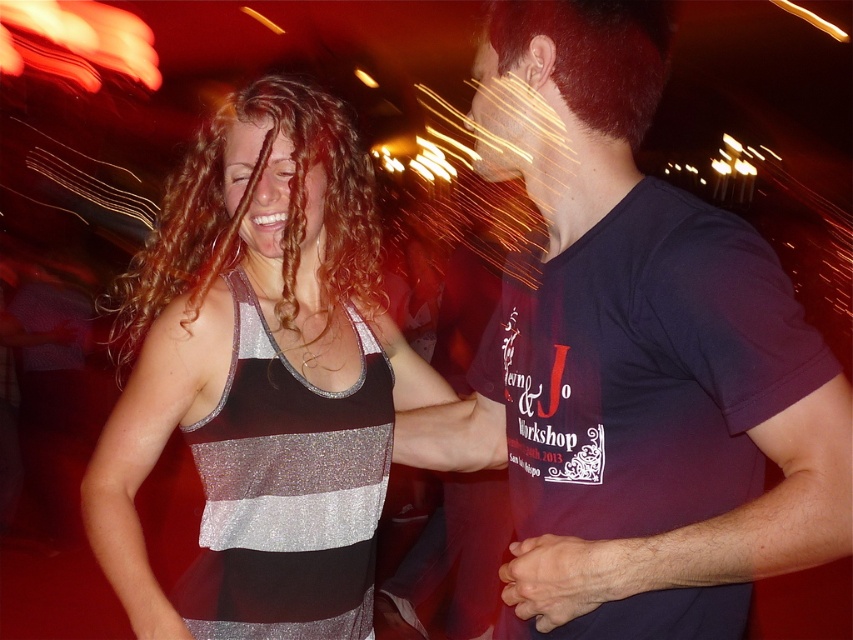
Consider the image. You are at a party and want to take a photo of the shiny silver tank top at center without the dark brown hair at upper right blocking it. How should you adjust your position?

Move to the side so that the dark brown hair at upper right is no longer in front of the shiny silver tank top at center.

You are at a party and notice two people with distinct hairstyles. The woman with curly brown hair at left and the person with dark brown hair at upper right. Which hairstyle is positioned higher in the image?

The curly brown hair at left is taller than dark brown hair at upper right.